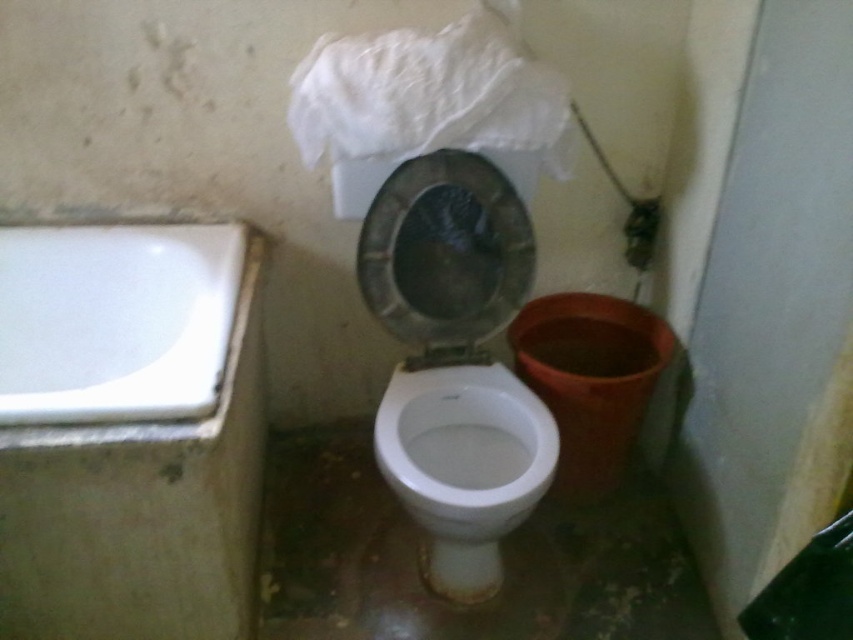
Does white glossy bathtub at left have a lesser height compared to white glossy toilet bowl at center?

Correct, white glossy bathtub at left is not as tall as white glossy toilet bowl at center.

Between point (160, 284) and point (518, 394), which one is positioned in front?

Positioned in front is point (518, 394).

Is point (221, 349) positioned after point (422, 499)?

No.

Where is `white glossy bathtub at left`? The width and height of the screenshot is (853, 640). white glossy bathtub at left is located at coordinates (114, 321).

I want to click on white crumpled paper at upper center, so click(425, 106).

Between point (373, 156) and point (541, 401), which one is positioned in front?

Point (373, 156)

Measure the distance between point (x=471, y=61) and camera.

Point (x=471, y=61) and camera are 4.41 feet apart from each other.

Locate an element on the screen. white crumpled paper at upper center is located at coordinates (425, 106).

Who is positioned more to the right, white glossy bathtub at left or white crumpled paper at upper center?

Positioned to the right is white crumpled paper at upper center.

Between point (236, 260) and point (454, 32), which one is positioned behind?

Positioned behind is point (236, 260).

The image size is (853, 640). I want to click on white glossy bathtub at left, so pyautogui.click(x=114, y=321).